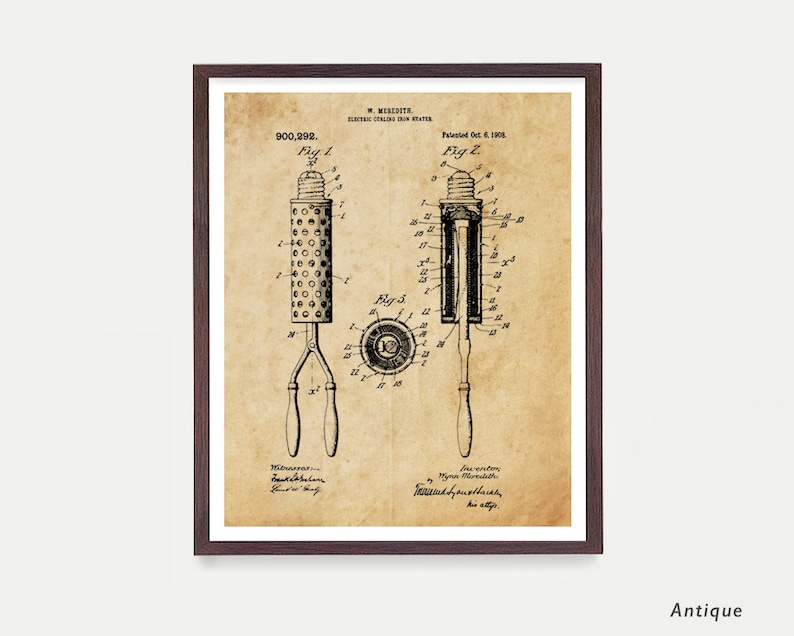
Image resolution: width=794 pixels, height=636 pixels. What are the coordinates of `brown wooden frame` in the screenshot? It's located at (515, 551), (595, 354), (205, 301).